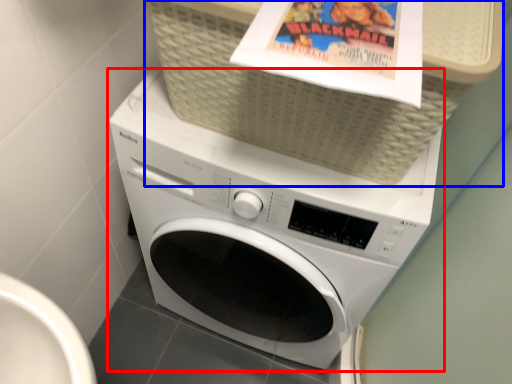
Question: Which of the following is the closest to the observer, washing machine (highlighted by a red box) or basket (highlighted by a blue box)?

Choices:
 (A) washing machine
 (B) basket

Answer: (B)